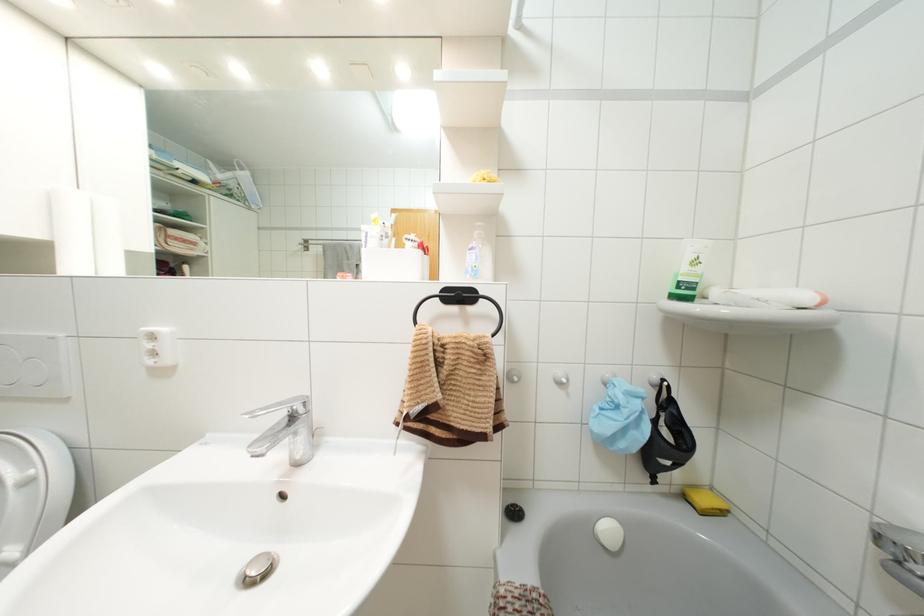
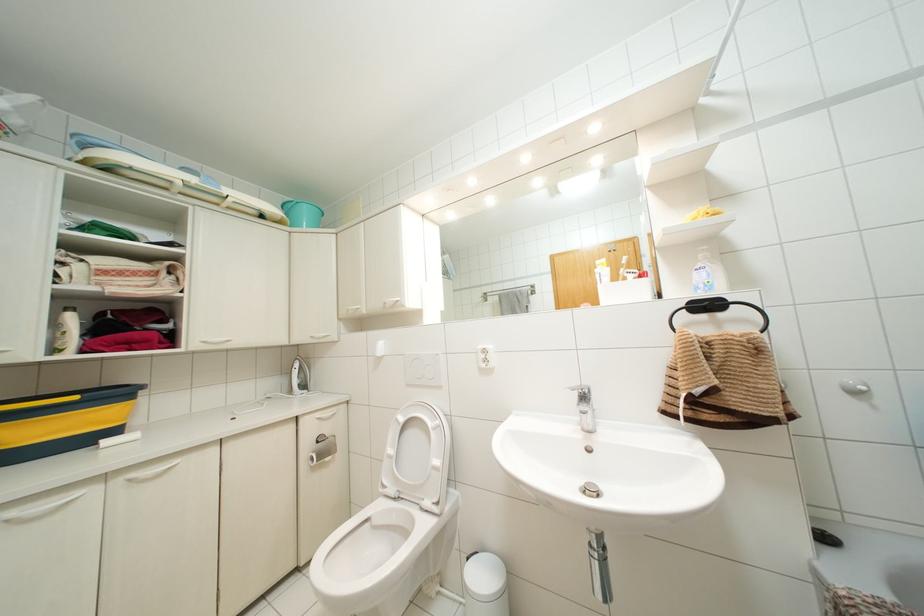
Question: The first image is from the beginning of the video and the second image is from the end. How did the camera likely rotate when shooting the video?

Choices:
 (A) Left
 (B) Right
 (C) Up
 (D) Down

Answer: (A)